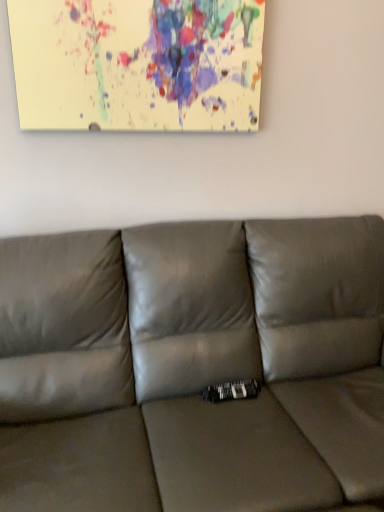
Question: Would you say paint splatter canvas at upper center is to the left or to the right of satin gray couch at center in the picture?

Choices:
 (A) left
 (B) right

Answer: (A)

Question: Considering their positions, is paint splatter canvas at upper center located in front of or behind satin gray couch at center?

Choices:
 (A) front
 (B) behind

Answer: (B)

Question: Is paint splatter canvas at upper center bigger or smaller than satin gray couch at center?

Choices:
 (A) small
 (B) big

Answer: (A)

Question: Looking at their shapes, would you say satin gray couch at center is wider or thinner than paint splatter canvas at upper center?

Choices:
 (A) thin
 (B) wide

Answer: (B)

Question: From the image's perspective, is satin gray couch at center located above or below paint splatter canvas at upper center?

Choices:
 (A) below
 (B) above

Answer: (A)

Question: Is satin gray couch at center to the left or to the right of paint splatter canvas at upper center in the image?

Choices:
 (A) left
 (B) right

Answer: (B)

Question: Choose the correct answer: Is satin gray couch at center inside paint splatter canvas at upper center or outside it?

Choices:
 (A) outside
 (B) inside

Answer: (A)